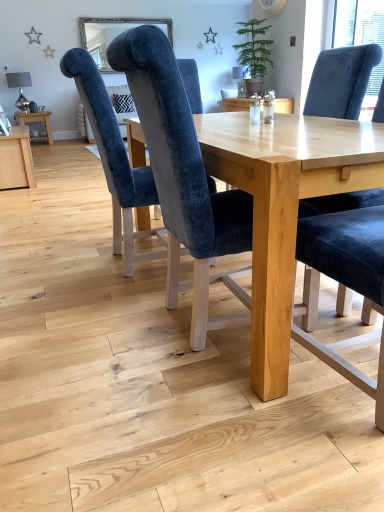
Where is `vacant area that is in front of velvet blue chair at center, positioned as the 2th chair in right-to-left order`? This screenshot has height=512, width=384. vacant area that is in front of velvet blue chair at center, positioned as the 2th chair in right-to-left order is located at coordinates (203, 416).